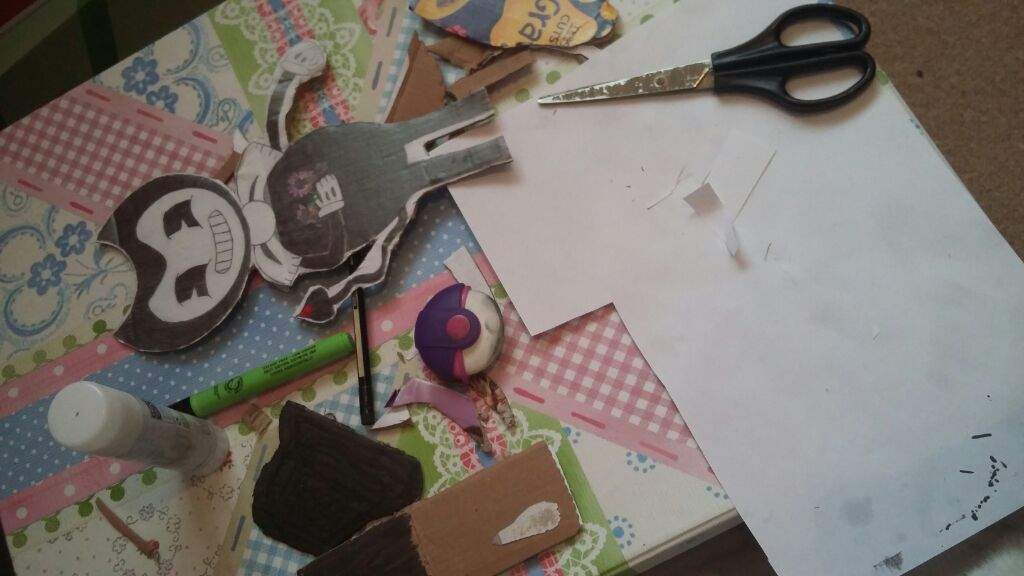
I want to click on pen, so pos(364,384).